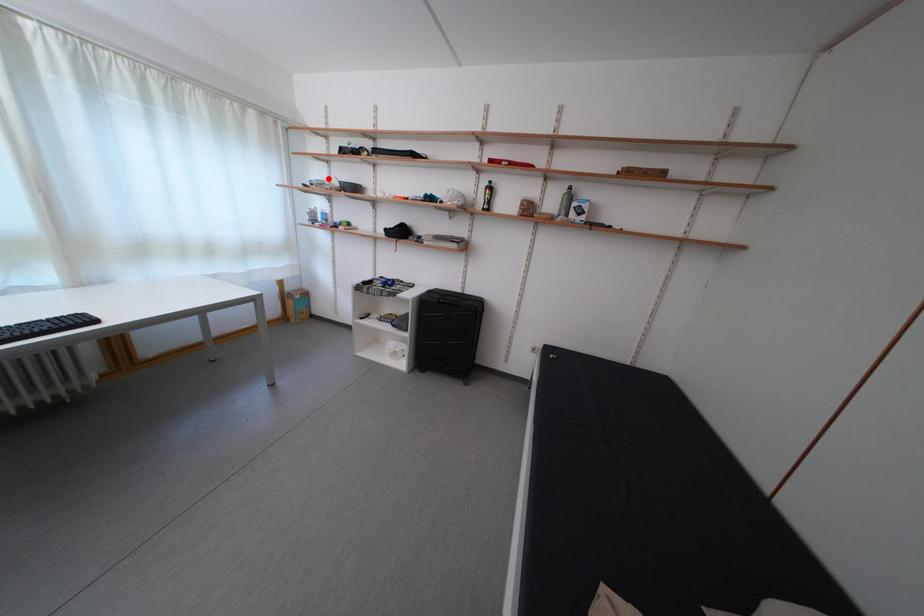
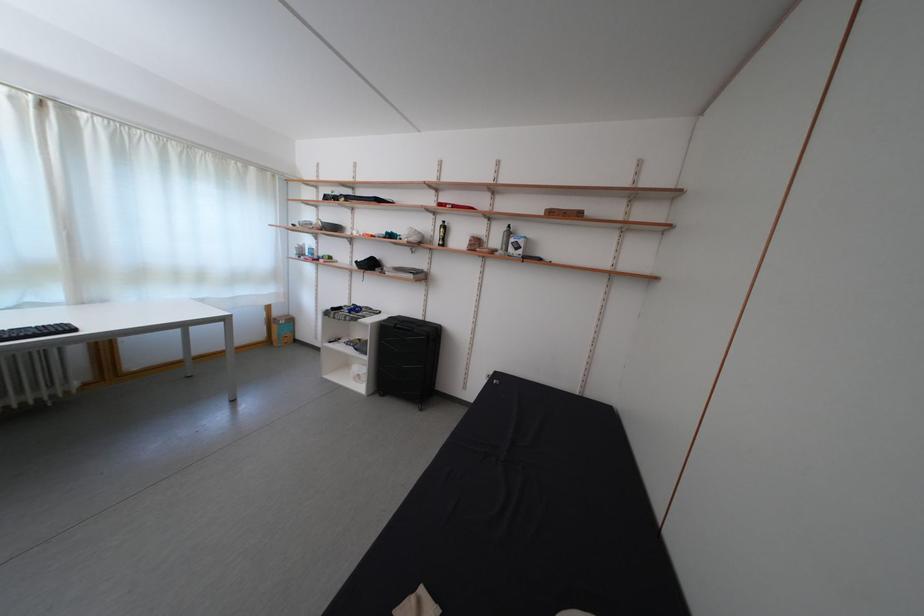
Locate, in the second image, the point that corresponds to the highlighted location in the first image.

(319, 221)